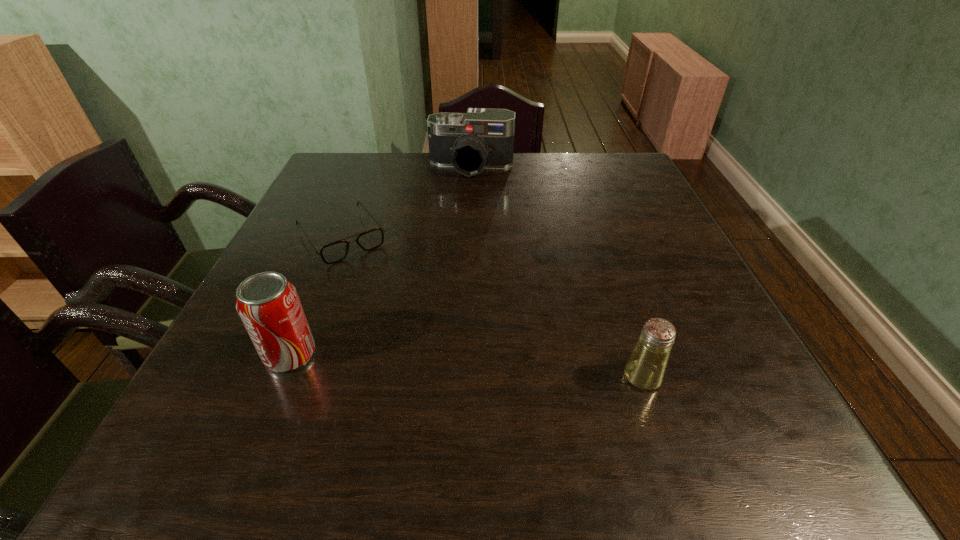
Image resolution: width=960 pixels, height=540 pixels. Identify the location of soda can. (268, 304).

Where is `the rightmost object`? The height and width of the screenshot is (540, 960). the rightmost object is located at coordinates (645, 369).

The height and width of the screenshot is (540, 960). I want to click on the second shortest object, so click(645, 369).

Where is `the shortest object`? This screenshot has height=540, width=960. the shortest object is located at coordinates (337, 251).

In order to click on the second farthest object in this screenshot , I will do `click(337, 251)`.

Identify the location of the third object from left to right. The image size is (960, 540). (481, 138).

This screenshot has width=960, height=540. What are the coordinates of `camera` in the screenshot? It's located at (481, 138).

Locate an element on the screen. This screenshot has height=540, width=960. vacant space situated on the back of the soda can is located at coordinates (336, 244).

At what (x,y) coordinates should I click in order to perform the action: click on vacant area located on the left of the rightmost object. Please return your answer as a coordinate pair (x, y). The height and width of the screenshot is (540, 960). Looking at the image, I should click on (537, 377).

Identify the location of free point located on the front-facing side of the sunglasses. Image resolution: width=960 pixels, height=540 pixels. (379, 290).